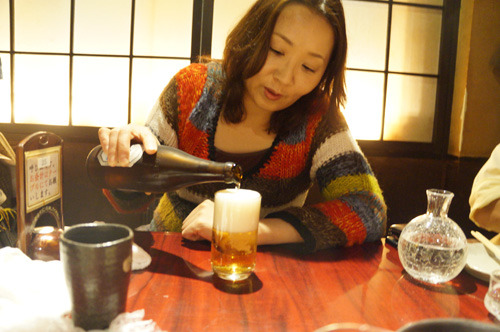
At what (x,y) coordinates should I click in order to perform the action: click on glass. Please return your answer as a coordinate pair (x, y). This screenshot has width=500, height=332. Looking at the image, I should click on (226, 263).